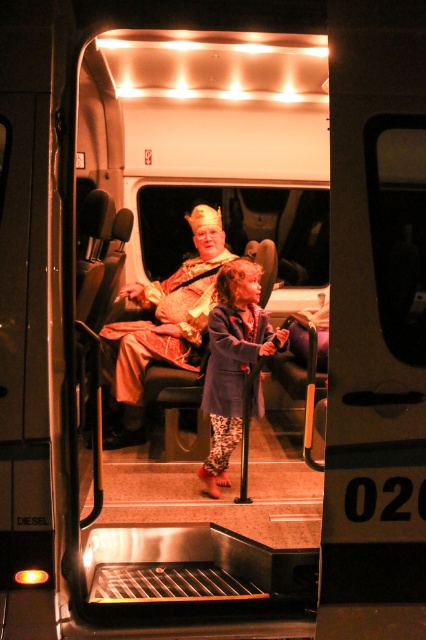
Question: Does gold metallic crown at center have a lesser width compared to blue denim jacket at center?

Choices:
 (A) yes
 (B) no

Answer: (B)

Question: Is gold metallic crown at center bigger than blue denim jacket at center?

Choices:
 (A) no
 (B) yes

Answer: (B)

Question: Is gold metallic crown at center positioned in front of blue denim jacket at center?

Choices:
 (A) no
 (B) yes

Answer: (A)

Question: Among these objects, which one is nearest to the camera?

Choices:
 (A) blue denim jacket at center
 (B) gold metallic crown at center

Answer: (A)